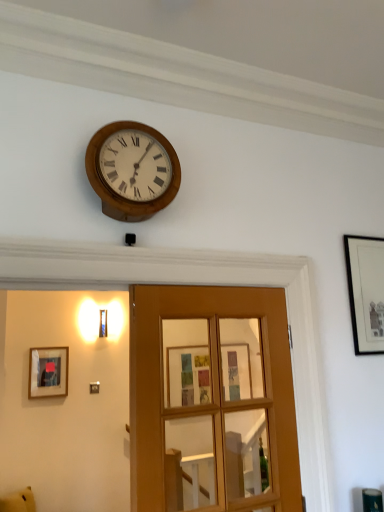
Question: Is black matte picture frame at upper right, which is the first picture frame from front to back, to the left of wooden glass door at center from the viewer's perspective?

Choices:
 (A) no
 (B) yes

Answer: (A)

Question: Is black matte picture frame at upper right, the first picture frame from the top, bigger than wooden glass door at center?

Choices:
 (A) no
 (B) yes

Answer: (A)

Question: Does black matte picture frame at upper right, which is the second picture frame from back to front, have a lesser height compared to wooden glass door at center?

Choices:
 (A) yes
 (B) no

Answer: (A)

Question: Could you tell me if black matte picture frame at upper right, which is counted as the 1th picture frame, starting from the right, is facing wooden glass door at center?

Choices:
 (A) yes
 (B) no

Answer: (B)

Question: Is black matte picture frame at upper right, which is the first picture frame from front to back, placed right next to wooden glass door at center?

Choices:
 (A) no
 (B) yes

Answer: (A)

Question: Visually, is yellow plush toy at lower left positioned to the left or to the right of black matte picture frame at upper right, which is counted as the 1th picture frame, starting from the right?

Choices:
 (A) left
 (B) right

Answer: (A)

Question: Is yellow plush toy at lower left situated inside black matte picture frame at upper right, which is the first picture frame from front to back, or outside?

Choices:
 (A) outside
 (B) inside

Answer: (A)

Question: Is point (28, 488) positioned closer to the camera than point (349, 285)?

Choices:
 (A) closer
 (B) farther

Answer: (B)

Question: In the image, is yellow plush toy at lower left positioned in front of or behind black matte picture frame at upper right, which is counted as the 1th picture frame, starting from the right?

Choices:
 (A) behind
 (B) front

Answer: (A)

Question: From their relative heights in the image, would you say wooden clock at upper center is taller or shorter than matte black picture frame at left, which is counted as the first picture frame, starting from the bottom?

Choices:
 (A) tall
 (B) short

Answer: (B)

Question: Does point (132, 219) appear closer or farther from the camera than point (64, 378)?

Choices:
 (A) farther
 (B) closer

Answer: (B)

Question: In terms of width, does wooden clock at upper center look wider or thinner when compared to matte black picture frame at left, placed as the second picture frame when sorted from front to back?

Choices:
 (A) thin
 (B) wide

Answer: (B)

Question: Is wooden clock at upper center in front of or behind matte black picture frame at left, positioned as the first picture frame in left-to-right order, in the image?

Choices:
 (A) behind
 (B) front

Answer: (B)

Question: Considering the positions of black matte picture frame at upper right, which is the second picture frame from back to front, and wooden clock at upper center in the image, is black matte picture frame at upper right, which is the second picture frame from back to front, taller or shorter than wooden clock at upper center?

Choices:
 (A) short
 (B) tall

Answer: (B)

Question: Is black matte picture frame at upper right, which is the first picture frame from front to back, wider or thinner than wooden clock at upper center?

Choices:
 (A) wide
 (B) thin

Answer: (B)